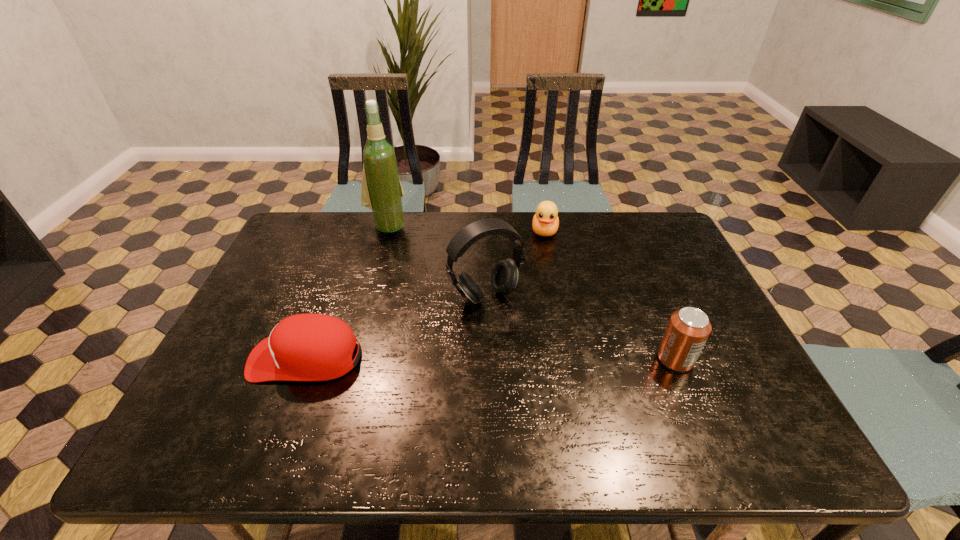
In order to click on object that is at the left edge in this screenshot , I will do `click(305, 347)`.

The image size is (960, 540). What are the coordinates of `object present at the right edge` in the screenshot? It's located at point(688,329).

Find the location of a particular element. The width and height of the screenshot is (960, 540). object present at the near left corner is located at coordinates (305, 347).

In the image, there is a desktop. Where is `vacant space at the far edge`? vacant space at the far edge is located at coordinates (362, 229).

Image resolution: width=960 pixels, height=540 pixels. In the image, there is a desktop. In order to click on vacant space at the near edge in this screenshot , I will do `click(342, 392)`.

At what (x,y) coordinates should I click in order to perform the action: click on vacant space at the left edge of the desktop. Please return your answer as a coordinate pair (x, y). Looking at the image, I should click on (271, 314).

In the image, there is a desktop. Where is `vacant space at the right edge`? Image resolution: width=960 pixels, height=540 pixels. vacant space at the right edge is located at coordinates (702, 286).

Locate an element on the screen. Image resolution: width=960 pixels, height=540 pixels. vacant area at the far right corner of the desktop is located at coordinates (636, 213).

At what (x,y) coordinates should I click in order to perform the action: click on vacant space in between the earphone and the wine bottle. Please return your answer as a coordinate pair (x, y). The image size is (960, 540). Looking at the image, I should click on (436, 261).

This screenshot has width=960, height=540. Identify the location of unoccupied area between the wine bottle and the baseball cap. (347, 292).